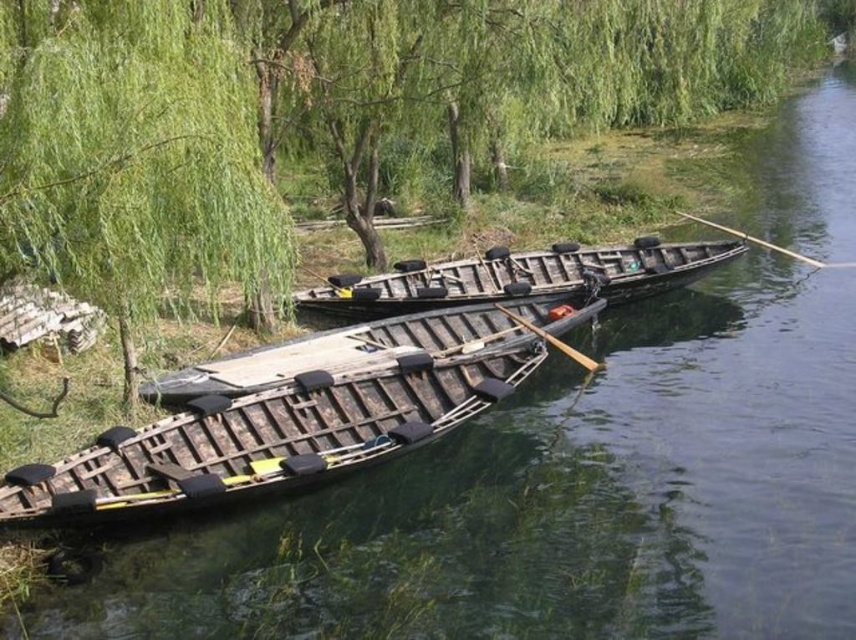
Looking at this image, which of these two, wooden smooth paddle at right or wooden paddle at center, stands shorter?

Standing shorter between the two is wooden smooth paddle at right.

Does wooden smooth paddle at right appear over wooden paddle at center?

Yes, wooden smooth paddle at right is above wooden paddle at center.

Is point (837, 264) more distant than point (541, 332)?

Yes, it is.

The height and width of the screenshot is (640, 856). Identify the location of wooden smooth paddle at right. (767, 243).

The width and height of the screenshot is (856, 640). In order to click on wooden canoe at center in this screenshot , I will do `click(520, 276)`.

Is wooden canoe at center wider than wooden paddle at center?

Correct, the width of wooden canoe at center exceeds that of wooden paddle at center.

What do you see at coordinates (520, 276) in the screenshot? I see `wooden canoe at center` at bounding box center [520, 276].

Identify the location of wooden canoe at center. The height and width of the screenshot is (640, 856). (520, 276).

Is green leafy willow at upper left shorter than wooden boat at center?

In fact, green leafy willow at upper left may be taller than wooden boat at center.

Who is positioned more to the left, green leafy willow at upper left or wooden boat at center?

From the viewer's perspective, wooden boat at center appears more on the left side.

Locate an element on the screen. green leafy willow at upper left is located at coordinates (134, 154).

At what (x,y) coordinates should I click in order to perform the action: click on green leafy willow at upper left. Please return your answer as a coordinate pair (x, y). This screenshot has width=856, height=640. Looking at the image, I should click on (134, 154).